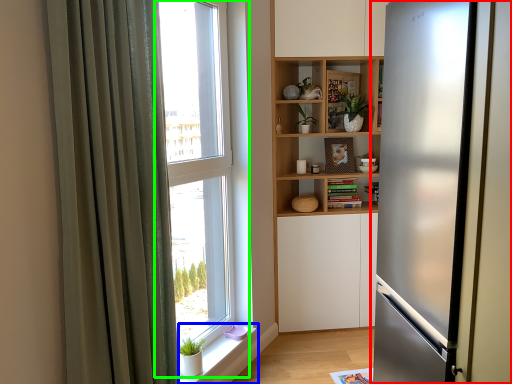
Question: Based on their relative distances, which object is farther from refrigerator (highlighted by a red box)? Choose from window sill (highlighted by a blue box) and window (highlighted by a green box).

Choices:
 (A) window sill
 (B) window

Answer: (A)